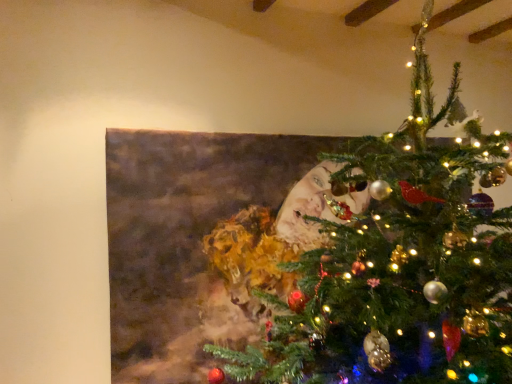
Find the location of `green textured christmas tree at center`. green textured christmas tree at center is located at coordinates (400, 263).

Image resolution: width=512 pixels, height=384 pixels. What do you see at coordinates (400, 263) in the screenshot? I see `green textured christmas tree at center` at bounding box center [400, 263].

Locate an element on the screen. The width and height of the screenshot is (512, 384). green textured christmas tree at center is located at coordinates (400, 263).